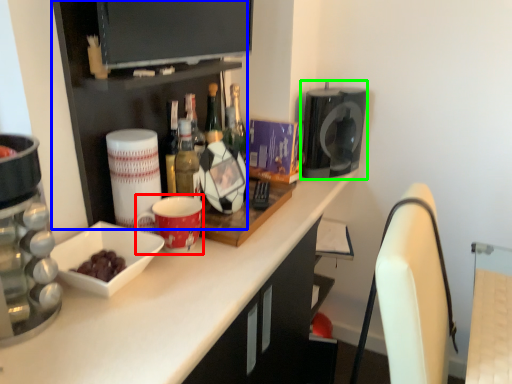
Question: Considering the real-world distances, which object is closest to mug (highlighted by a red box)? shelf (highlighted by a blue box) or appliance (highlighted by a green box).

Choices:
 (A) shelf
 (B) appliance

Answer: (A)